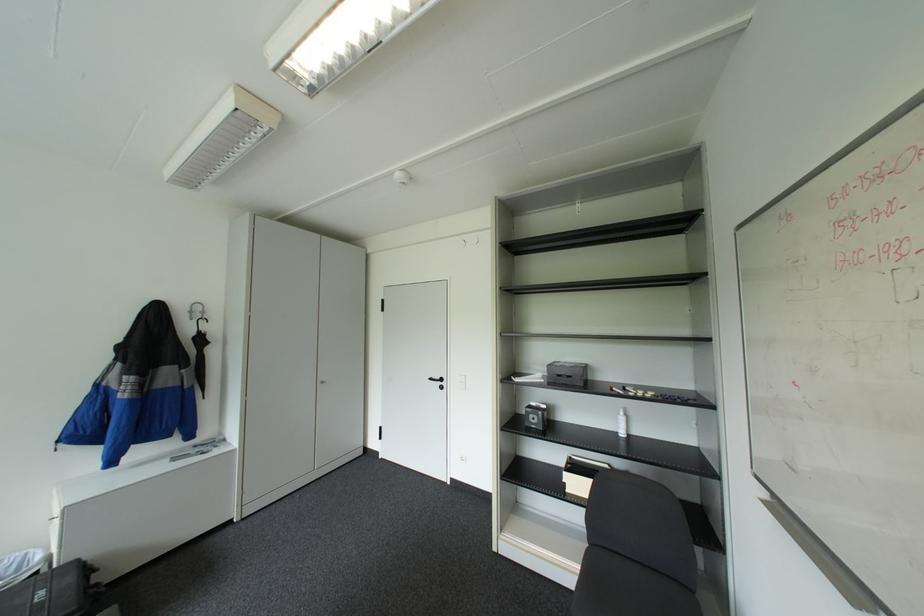
The height and width of the screenshot is (616, 924). In order to click on white spray bottle in this screenshot , I will do `click(622, 423)`.